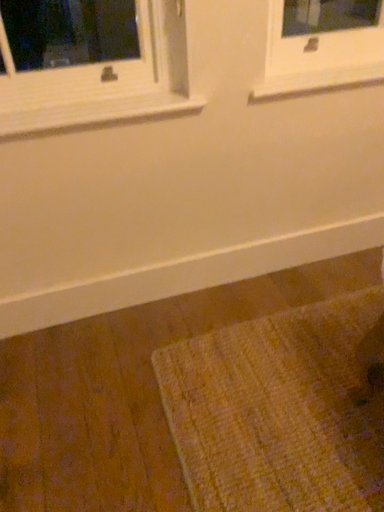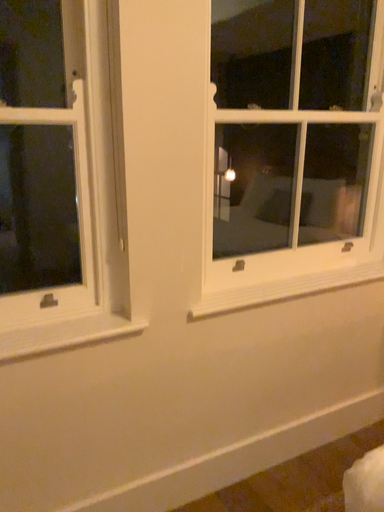
Question: How did the camera likely rotate when shooting the video?

Choices:
 (A) rotated upward
 (B) rotated downward

Answer: (A)